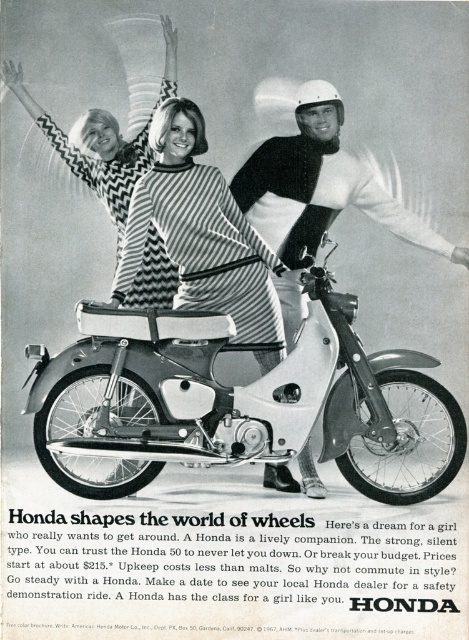
You are standing in front of the vintage Honda motorcycle advertisement. There are two points marked on the image. Which point is closer to you, point at coordinate (340,401) or point at coordinate (316,240)?

Point at coordinate (340,401) is closer to you than point at coordinate (316,240).

You are a photographer trying to capture the exact center of the vintage Honda advertisement. The advertisement has a coordinate system where the bottom left corner is at point 0,0 and the top right corner is at 1,1. You need to focus your camera on the motorcycle. Where should you aim your camera to ensure the white matte motorcycle at center is perfectly centered in your shot?

The white matte motorcycle at center is located at point (226,400), so you should aim your camera at that coordinate to center it.

You are a photographer adjusting your camera settings to focus on two points in the image. The first point is at coordinates point (272, 486) and the second is at point (333, 180). Which point should you focus on first if you want to ensure the closest object is in sharp focus?

You should focus on point (272, 486) first because it is closer to the camera than point (333, 180).